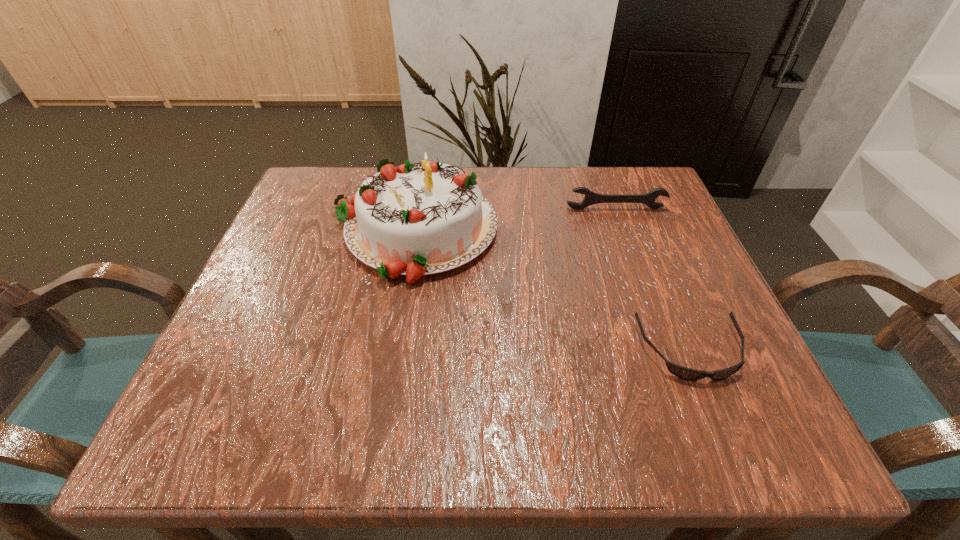
Where is `wrench situated at the right edge`? The width and height of the screenshot is (960, 540). wrench situated at the right edge is located at coordinates (591, 198).

The width and height of the screenshot is (960, 540). What are the coordinates of `sunglasses located in the right edge section of the desktop` in the screenshot? It's located at (688, 374).

Find the location of a particular element. object positioned at the far left corner is located at coordinates (414, 220).

This screenshot has height=540, width=960. I want to click on object located in the far right corner section of the desktop, so click(591, 198).

Locate an element on the screen. The height and width of the screenshot is (540, 960). free region at the far edge of the desktop is located at coordinates (539, 176).

At what (x,y) coordinates should I click in order to perform the action: click on free location at the left edge of the desktop. Please return your answer as a coordinate pair (x, y). Image resolution: width=960 pixels, height=540 pixels. Looking at the image, I should click on (263, 303).

At what (x,y) coordinates should I click in order to perform the action: click on vacant area at the right edge. Please return your answer as a coordinate pair (x, y). The width and height of the screenshot is (960, 540). Looking at the image, I should click on (686, 281).

This screenshot has height=540, width=960. Find the location of `free region at the far left corner of the desktop`. free region at the far left corner of the desktop is located at coordinates (361, 178).

Identify the location of unoccupied area between the nearest object and the second tallest object. (653, 280).

Identify the location of free point between the second tallest object and the tallest object. (515, 219).